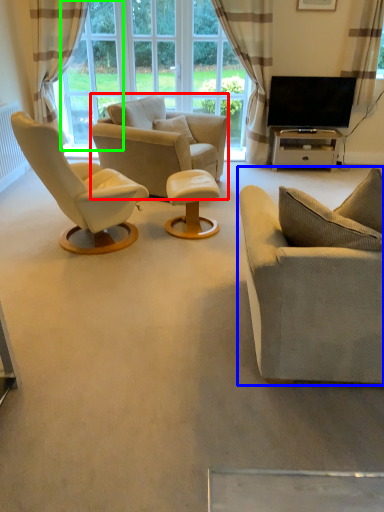
Question: Which is nearer to the chair (highlighted by a red box)? studio couch (highlighted by a blue box) or window screen (highlighted by a green box).

Choices:
 (A) studio couch
 (B) window screen

Answer: (B)